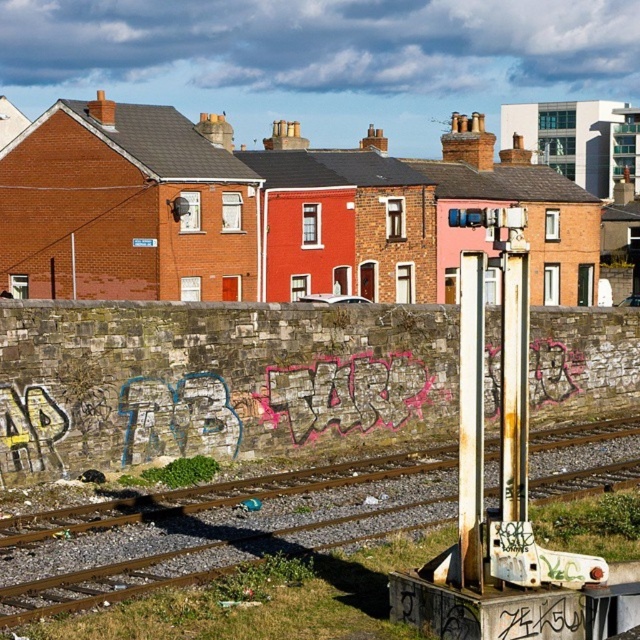
Is rusty metal train track at lower center below rusty metal pole at center-right?

Yes, rusty metal train track at lower center is below rusty metal pole at center-right.

Identify the location of rusty metal train track at lower center. The height and width of the screenshot is (640, 640). (205, 529).

The height and width of the screenshot is (640, 640). Identify the location of rusty metal train track at lower center. (205, 529).

Identify the location of rusty metal train track at lower center. (205, 529).